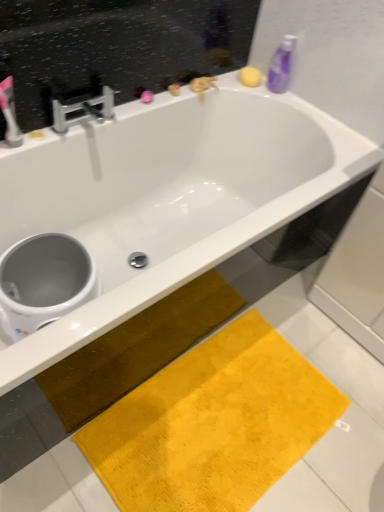
You are a GUI agent. You are given a task and a screenshot of the screen. Output one action in this format:
    pyautogui.click(x=<x>, y=<y>)
    Task: Click on the free location in front of purple plastic bottle at upper right
    
    Given the screenshot: What is the action you would take?
    pyautogui.click(x=297, y=108)